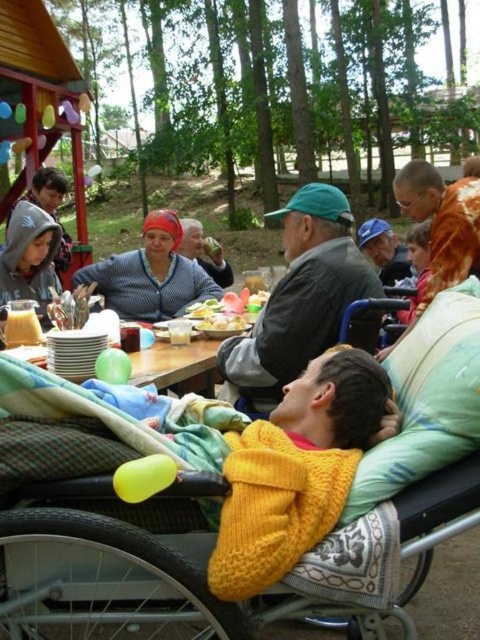
You are a photographer trying to take a portrait of the person in the wheelchair. The green fabric cap at center and the black plastic wheelchair at center are both in the frame. Which object is taller and might block the view of the person?

The green fabric cap at center is much taller than the black plastic wheelchair at center, so it might block the view of the person.

You are a photographer trying to capture a clear shot of the black plastic wheelchair at center without the green fabric cap at center blocking it. How can you adjust your position to achieve this?

The green fabric cap at center is positioned over the black plastic wheelchair at center. To avoid the cap blocking the wheelchair, move your camera position lower so that the cap is no longer covering the wheelchair in the frame.

You are a delivery person who needs to place a small package on the ground near the yellow knitted baby carriage at center. Given that the delivery zone is a 1x1 meter square starting at coordinate point 0.8, 0.4, will the package be within the delivery zone?

The yellow knitted baby carriage at center is located at point (215, 532). The delivery zone starts at (192, 512) and spans 1x1 meter. Since 0.834 and 0.448 are within the range of 0.8 to 1.8 in both x and y coordinates, the package will be within the delivery zone.